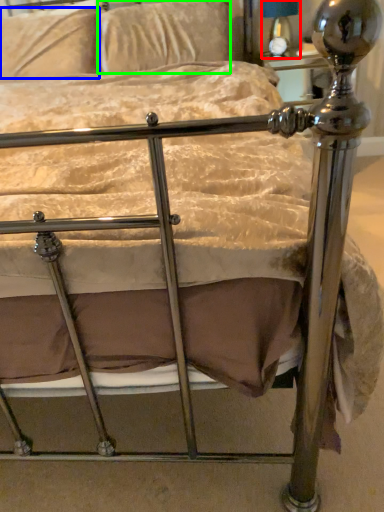
Question: Which object is positioned farthest from table lamp (highlighted by a red box)? Select from pillow (highlighted by a blue box) and pillow (highlighted by a green box).

Choices:
 (A) pillow
 (B) pillow

Answer: (A)